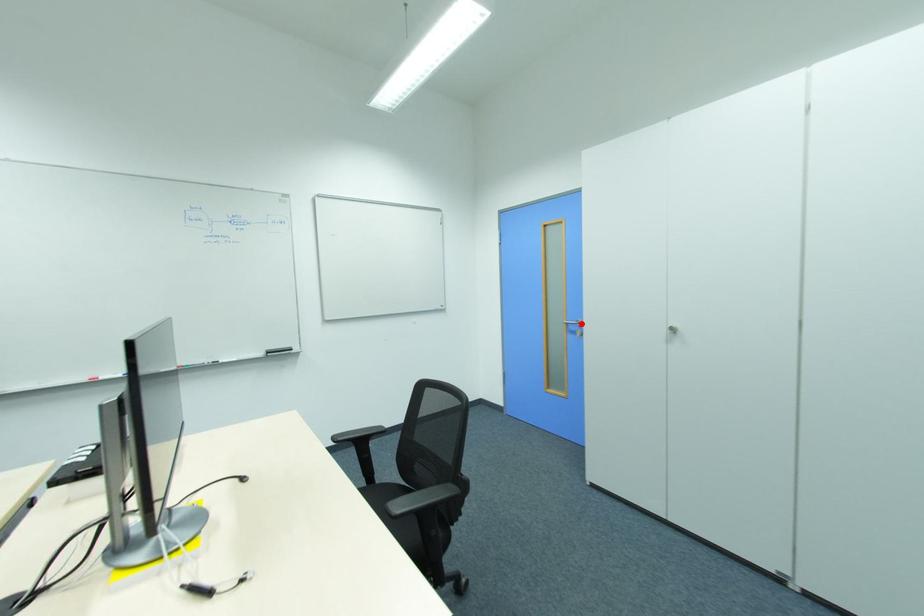
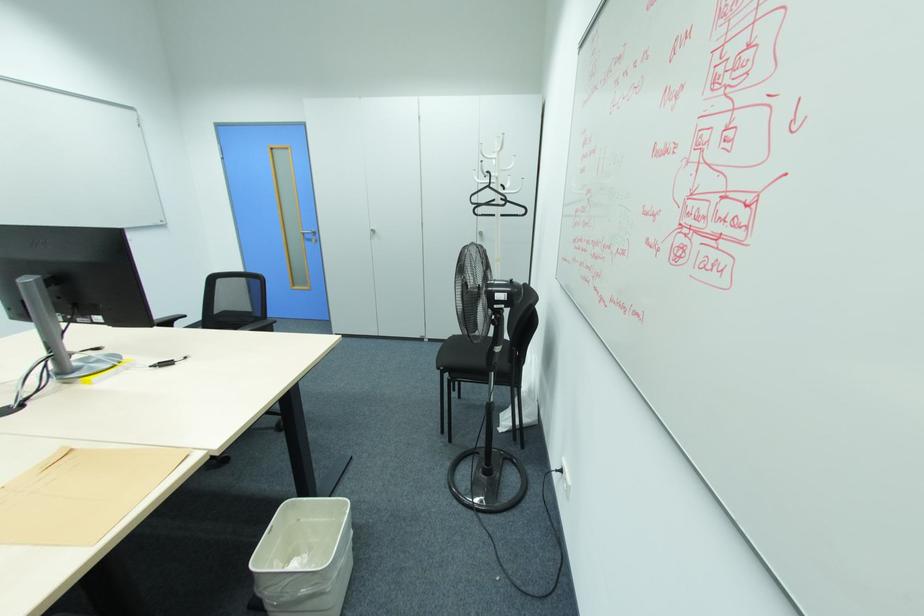
The point at the highlighted location is marked in the first image. Where is the corresponding point in the second image?

(314, 233)